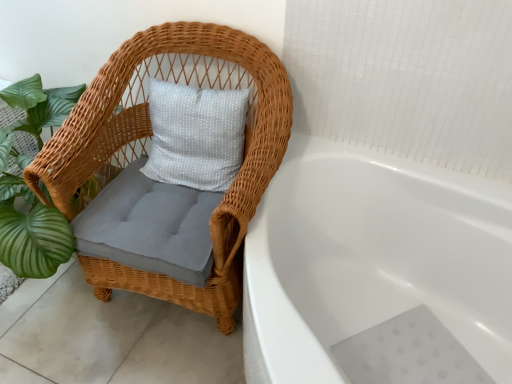
What do you see at coordinates (151, 135) in the screenshot? I see `woven wicker chair at left` at bounding box center [151, 135].

This screenshot has width=512, height=384. Identify the location of woven wicker chair at left. (151, 135).

What do you see at coordinates (372, 259) in the screenshot? This screenshot has width=512, height=384. I see `white glossy bathtub at center` at bounding box center [372, 259].

You are a GUI agent. You are given a task and a screenshot of the screen. Output one action in this format:
    pyautogui.click(x=<x>, y=<y>)
    Task: Click on the white glossy bathtub at center
    This screenshot has height=384, width=512.
    Given the screenshot: What is the action you would take?
    point(372,259)

In order to face white glossy bathtub at center, should I rotate leftwards or rightwards?

It's best to rotate right around 16.735 degrees.

In order to click on woven wicker chair at left in this screenshot , I will do `click(151, 135)`.

Is woven wicker chair at left at the right side of white glossy bathtub at center?

Incorrect, woven wicker chair at left is not on the right side of white glossy bathtub at center.

Does woven wicker chair at left come in front of white glossy bathtub at center?

No, woven wicker chair at left is further to the viewer.

Is point (59, 192) farther from camera compared to point (406, 296)?

No, it is not.

Consider the image. From the image's perspective, is woven wicker chair at left beneath white glossy bathtub at center?

Result: Actually, woven wicker chair at left appears above white glossy bathtub at center in the image.

From a real-world perspective, which object rests below the other?

From a 3D spatial view, white glossy bathtub at center is below.

Looking at their sizes, would you say woven wicker chair at left is wider or thinner than white glossy bathtub at center?

Considering their sizes, woven wicker chair at left looks slimmer than white glossy bathtub at center.

Does woven wicker chair at left have a greater height compared to white glossy bathtub at center?

Yes, woven wicker chair at left is taller than white glossy bathtub at center.

In terms of size, does woven wicker chair at left appear bigger or smaller than white glossy bathtub at center?

Considering their sizes, woven wicker chair at left takes up less space than white glossy bathtub at center.

Is woven wicker chair at left not within white glossy bathtub at center?

Yes, woven wicker chair at left is located beyond the bounds of white glossy bathtub at center.

Is the surface of woven wicker chair at left in direct contact with white glossy bathtub at center?

There is a gap between woven wicker chair at left and white glossy bathtub at center.

Is woven wicker chair at left oriented towards white glossy bathtub at center?

No.

How different are the orientations of woven wicker chair at left and white glossy bathtub at center in degrees?

There is a 0.698-degree angle between the facing directions of woven wicker chair at left and white glossy bathtub at center.

At what (x,y) coordinates should I click in order to perform the action: click on chair positioned vertically above the white glossy bathtub at center (from a real-world perspective). Please return your answer as a coordinate pair (x, y). The width and height of the screenshot is (512, 384). Looking at the image, I should click on (151, 135).

Which object is positioned more to the right, white glossy bathtub at center or woven wicker chair at left?

white glossy bathtub at center is more to the right.

Is the position of white glossy bathtub at center less distant than that of woven wicker chair at left?

Yes, white glossy bathtub at center is closer to the camera.

Is point (379, 154) in front of point (255, 78)?

No, (379, 154) is behind (255, 78).

From the image's perspective, is white glossy bathtub at center located above woven wicker chair at left?

No.

From a real-world perspective, is white glossy bathtub at center beneath woven wicker chair at left?

Indeed, from a real-world perspective, white glossy bathtub at center is positioned beneath woven wicker chair at left.

Which of these two, white glossy bathtub at center or woven wicker chair at left, is thinner?

With smaller width is woven wicker chair at left.

Is white glossy bathtub at center taller than woven wicker chair at left?

No, white glossy bathtub at center is not taller than woven wicker chair at left.

Looking at the image, does white glossy bathtub at center seem bigger or smaller compared to woven wicker chair at left?

Considering their sizes, white glossy bathtub at center takes up more space than woven wicker chair at left.

Is white glossy bathtub at center not inside woven wicker chair at left?

white glossy bathtub at center lies outside woven wicker chair at left's area.

Would you say white glossy bathtub at center is a long distance from woven wicker chair at left?

white glossy bathtub at center is actually quite close to woven wicker chair at left.

Is white glossy bathtub at center oriented away from woven wicker chair at left?

No.

Can you tell me how much white glossy bathtub at center and woven wicker chair at left differ in facing direction?

white glossy bathtub at center and woven wicker chair at left are facing 0.698 degrees away from each other.

Measure the distance between white glossy bathtub at center and woven wicker chair at left.

white glossy bathtub at center and woven wicker chair at left are 17.75 inches apart.

What are the coordinates of `bathtub lying on the right of woven wicker chair at left` in the screenshot? It's located at (372, 259).

At what (x,y) coordinates should I click in order to perform the action: click on bathtub on the right of woven wicker chair at left. Please return your answer as a coordinate pair (x, y). The height and width of the screenshot is (384, 512). Looking at the image, I should click on (372, 259).

In the image, there is a woven wicker chair at left. Where is `bathtub below it (from a real-world perspective)`? The height and width of the screenshot is (384, 512). bathtub below it (from a real-world perspective) is located at coordinates coord(372,259).